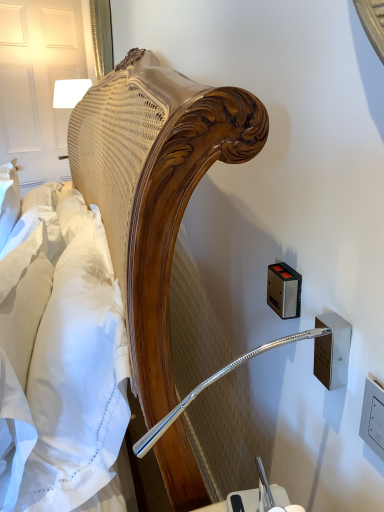
Question: Does metallic silver outlet at right, which is the 2th electric outlet from back to front, have a lesser width compared to metallic rectangular at right, the 2th electric outlet from the right?

Choices:
 (A) no
 (B) yes

Answer: (B)

Question: Are metallic silver outlet at right, marked as the second electric outlet in a left-to-right arrangement, and metallic rectangular at right, the 2th electric outlet from the right, far apart?

Choices:
 (A) yes
 (B) no

Answer: (B)

Question: Considering the relative sizes of metallic silver outlet at right, which is the 2th electric outlet from back to front, and metallic rectangular at right, arranged as the first electric outlet when viewed from the back, in the image provided, is metallic silver outlet at right, which is the 2th electric outlet from back to front, wider than metallic rectangular at right, arranged as the first electric outlet when viewed from the back,?

Choices:
 (A) yes
 (B) no

Answer: (B)

Question: Is metallic silver outlet at right, which is the 2th electric outlet from back to front, oriented away from metallic rectangular at right, arranged as the first electric outlet when viewed from the back?

Choices:
 (A) yes
 (B) no

Answer: (B)

Question: Is metallic silver outlet at right, marked as the second electric outlet in a left-to-right arrangement, bigger than metallic rectangular at right, arranged as the 1th electric outlet when viewed from the left?

Choices:
 (A) yes
 (B) no

Answer: (B)

Question: From their relative heights in the image, would you say metallic silver outlet at right, marked as the second electric outlet in a left-to-right arrangement, is taller or shorter than wooden bedside lamp at upper left?

Choices:
 (A) tall
 (B) short

Answer: (B)

Question: In terms of width, does metallic silver outlet at right, which is counted as the 1th electric outlet, starting from the right, look wider or thinner when compared to wooden bedside lamp at upper left?

Choices:
 (A) wide
 (B) thin

Answer: (B)

Question: Considering the relative positions of metallic silver outlet at right, the first electric outlet positioned from the front, and wooden bedside lamp at upper left in the image provided, is metallic silver outlet at right, the first electric outlet positioned from the front, to the left or to the right of wooden bedside lamp at upper left?

Choices:
 (A) left
 (B) right

Answer: (B)

Question: Would you say metallic silver outlet at right, the first electric outlet positioned from the front, is inside or outside wooden bedside lamp at upper left?

Choices:
 (A) inside
 (B) outside

Answer: (B)

Question: Is metallic silver outlet at right, which is counted as the 1th electric outlet, starting from the right, wider or thinner than metallic rectangular at right, arranged as the first electric outlet when viewed from the back?

Choices:
 (A) thin
 (B) wide

Answer: (A)

Question: Is point (324, 316) closer or farther from the camera than point (284, 304)?

Choices:
 (A) closer
 (B) farther

Answer: (A)

Question: Considering the positions of metallic silver outlet at right, marked as the second electric outlet in a left-to-right arrangement, and metallic rectangular at right, marked as the 2th electric outlet in a front-to-back arrangement, in the image, is metallic silver outlet at right, marked as the second electric outlet in a left-to-right arrangement, taller or shorter than metallic rectangular at right, marked as the 2th electric outlet in a front-to-back arrangement,?

Choices:
 (A) tall
 (B) short

Answer: (A)

Question: From a real-world perspective, relative to metallic rectangular at right, marked as the 2th electric outlet in a front-to-back arrangement, is metallic silver outlet at right, which is the 2th electric outlet from back to front, vertically above or below?

Choices:
 (A) above
 (B) below

Answer: (B)

Question: Is wooden bedside lamp at upper left spatially inside metallic rectangular at right, marked as the 2th electric outlet in a front-to-back arrangement, or outside of it?

Choices:
 (A) inside
 (B) outside

Answer: (B)

Question: From a real-world perspective, is wooden bedside lamp at upper left above or below metallic rectangular at right, arranged as the 1th electric outlet when viewed from the left?

Choices:
 (A) above
 (B) below

Answer: (A)